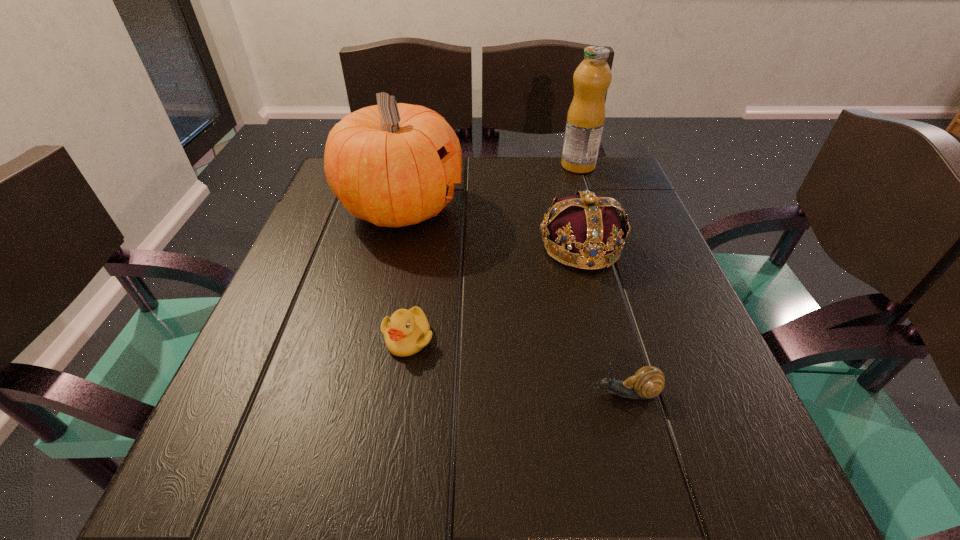
The width and height of the screenshot is (960, 540). Find the location of `the closest object to the escargot`. the closest object to the escargot is located at coordinates (590, 227).

The width and height of the screenshot is (960, 540). I want to click on blank area in the image that satisfies the following two spatial constraints: 1. on the back side of the crown; 2. on the front-facing side of the pumpkin, so click(571, 208).

Where is `free location that satisfies the following two spatial constraints: 1. on the front label of the fruit juice; 2. on the front-facing side of the fourth farthest object`? free location that satisfies the following two spatial constraints: 1. on the front label of the fruit juice; 2. on the front-facing side of the fourth farthest object is located at coordinates (635, 338).

Find the location of a particular element. This screenshot has height=540, width=960. vacant space that satisfies the following two spatial constraints: 1. on the front-facing side of the crown; 2. on the right side of the pumpkin is located at coordinates (392, 247).

Locate an element on the screen. Image resolution: width=960 pixels, height=540 pixels. blank area in the image that satisfies the following two spatial constraints: 1. on the front-facing side of the pumpkin; 2. on the left side of the crown is located at coordinates coord(392,247).

I want to click on vacant region that satisfies the following two spatial constraints: 1. on the front-facing side of the crown; 2. on the right side of the pumpkin, so click(392, 247).

I want to click on free spot that satisfies the following two spatial constraints: 1. on the front-facing side of the pumpkin; 2. on the right side of the crown, so click(392, 247).